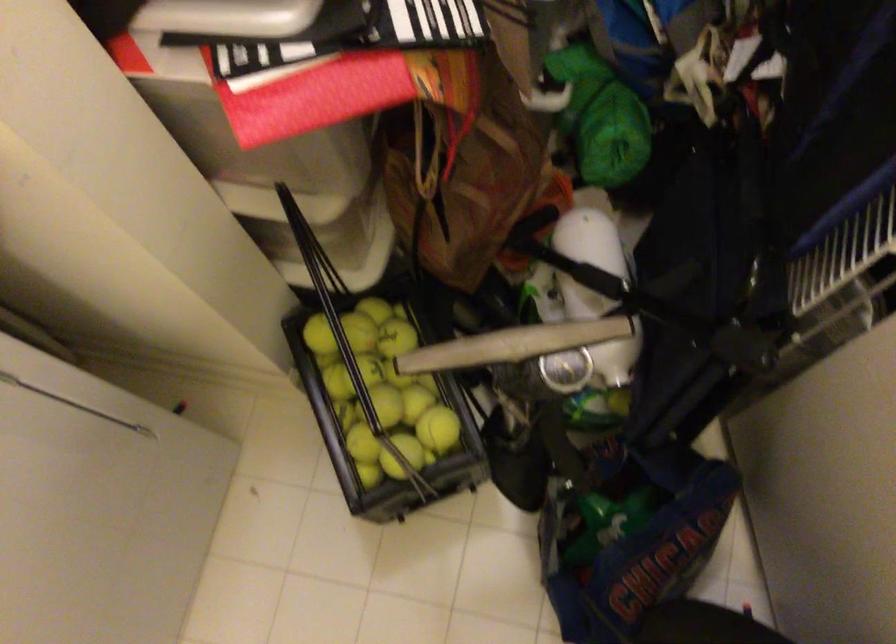
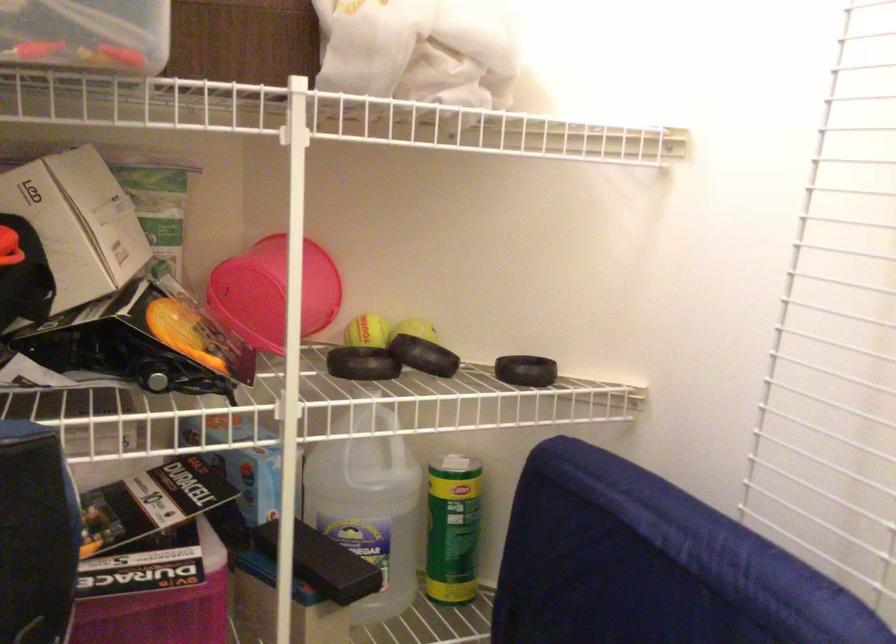
The images are taken continuously from a first-person perspective. In which direction is your viewpoint rotating?

The camera rotated toward right-up.